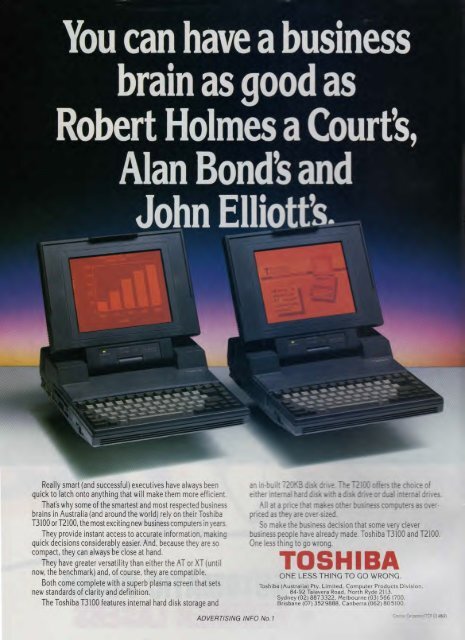
At what (x,y) coordinates should I click in order to perform the action: click on two black early-model computers. Please return your answer as a coordinate pair (x, y). Looking at the image, I should click on (132, 340), (322, 329).